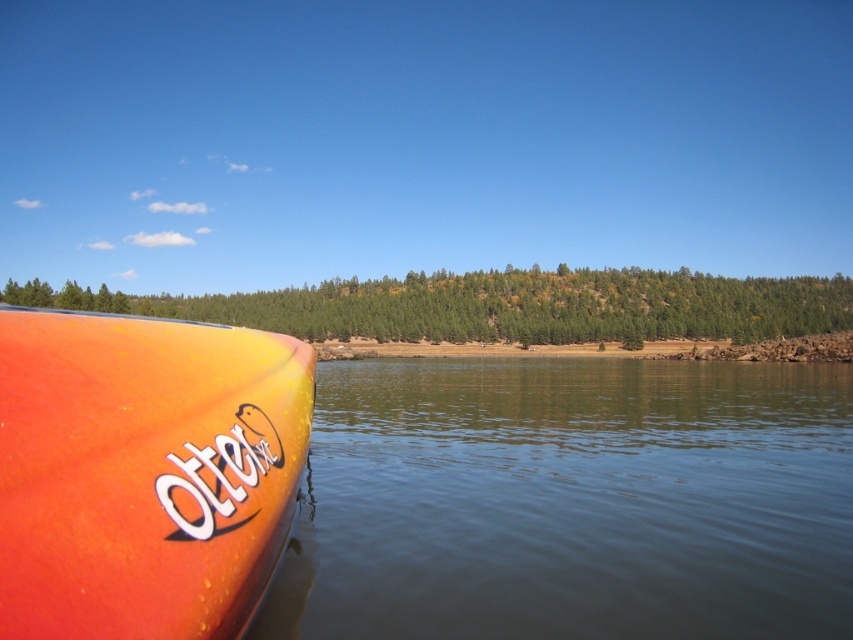
You are a photographer planning to capture the clear water at lower left and orange matte kayak at lower left in a single frame. Based on their sizes, which object would occupy more space in your photo?

The clear water at lower left occupies more space in the photo because it is bigger than the orange matte kayak at lower left.

You are a photographer planning to capture the clear water at lower left and the orange matte kayak at lower left in a single frame. Based on the scene, which object occupies more horizontal space in the image?

The clear water at lower left occupies more horizontal space than the orange matte kayak at lower left because its width surpasses that of the kayak.

You are standing at the edge of the water in the image. There is a point marked as point (572, 500). Where is this point located relative to the clear water at lower left?

The point (572, 500) is located at the clear water at lower left.